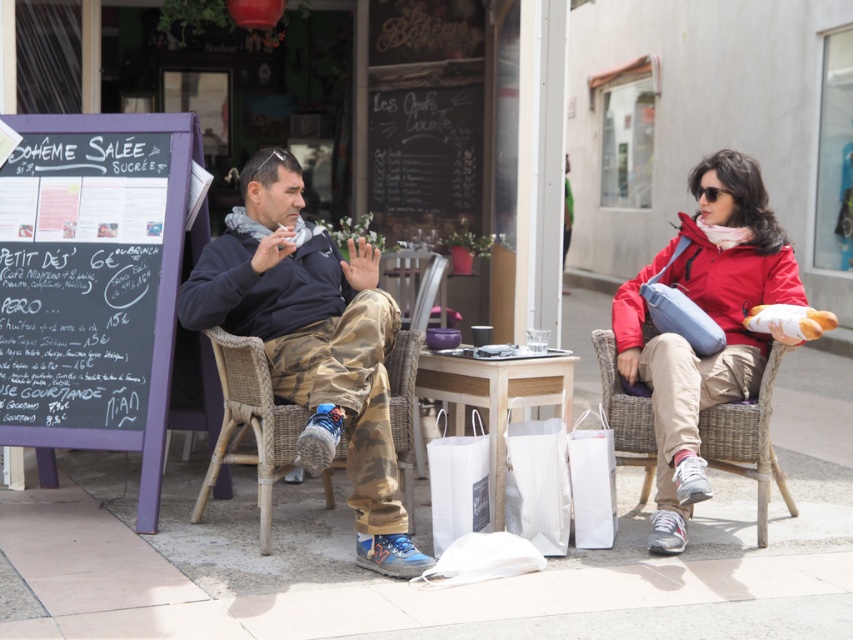
Question: Is camouflage pants at center below white paper bag at center?

Choices:
 (A) yes
 (B) no

Answer: (B)

Question: Estimate the real-world distances between objects in this image. Which object is closer to the chalkboard menu at left?

Choices:
 (A) white paper bag at center
 (B) woven wicker chair at right

Answer: (A)

Question: Which of these objects is positioned closest to the camouflage pants at center?

Choices:
 (A) white paper bag at center
 (B) camo pants at center

Answer: (B)

Question: Which point appears farthest from the camera in this image?

Choices:
 (A) (347, 470)
 (B) (293, 244)
 (C) (577, 424)

Answer: (C)

Question: Does camo pants at center have a smaller size compared to camouflage pants at center?

Choices:
 (A) no
 (B) yes

Answer: (A)

Question: Is woven wicker chair at right below white matte shopping bag at lower center?

Choices:
 (A) no
 (B) yes

Answer: (B)